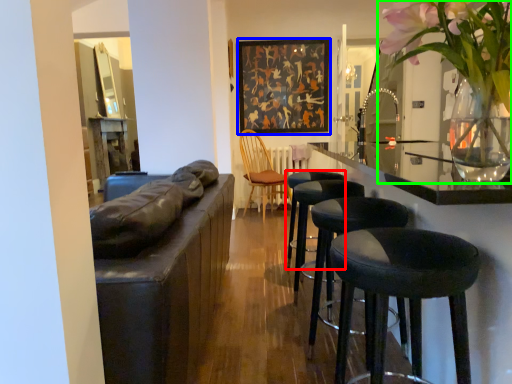
Question: Which object is positioned farthest from stool (highlighted by a red box)? Select from picture frame (highlighted by a blue box) and floral arrangement (highlighted by a green box).

Choices:
 (A) picture frame
 (B) floral arrangement

Answer: (A)